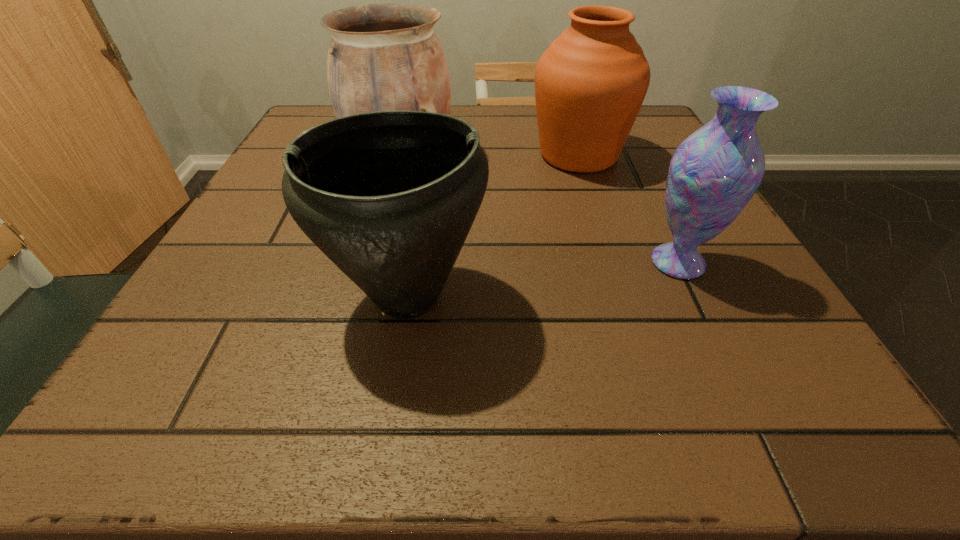
Choose which urn is the second nearest neighbor to the rightmost urn. Please provide its 2D coordinates. Your answer should be formatted as a tuple, i.e. [(x, y)], where the tuple contains the x and y coordinates of a point satisfying the conditions above.

[(389, 197)]

Identify which urn is located as the nearest to the rightmost urn. Please provide its 2D coordinates. Your answer should be formatted as a tuple, i.e. [(x, y)], where the tuple contains the x and y coordinates of a point satisfying the conditions above.

[(382, 57)]

Locate an element on the screen. The height and width of the screenshot is (540, 960). blank area in the image that satisfies the following two spatial constraints: 1. on the back side of the vase; 2. on the left side of the nearest urn is located at coordinates (413, 262).